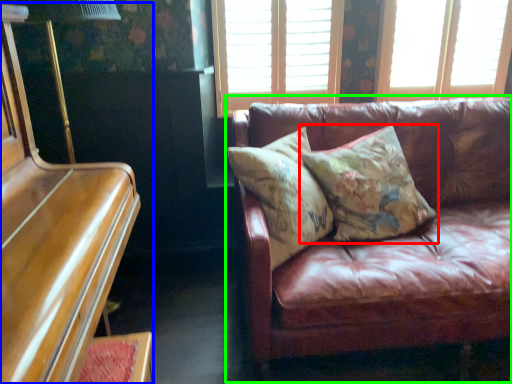
Question: Which object is the closest to the pillow (highlighted by a red box)? Choose among these: piano (highlighted by a blue box) or studio couch (highlighted by a green box).

Choices:
 (A) piano
 (B) studio couch

Answer: (B)